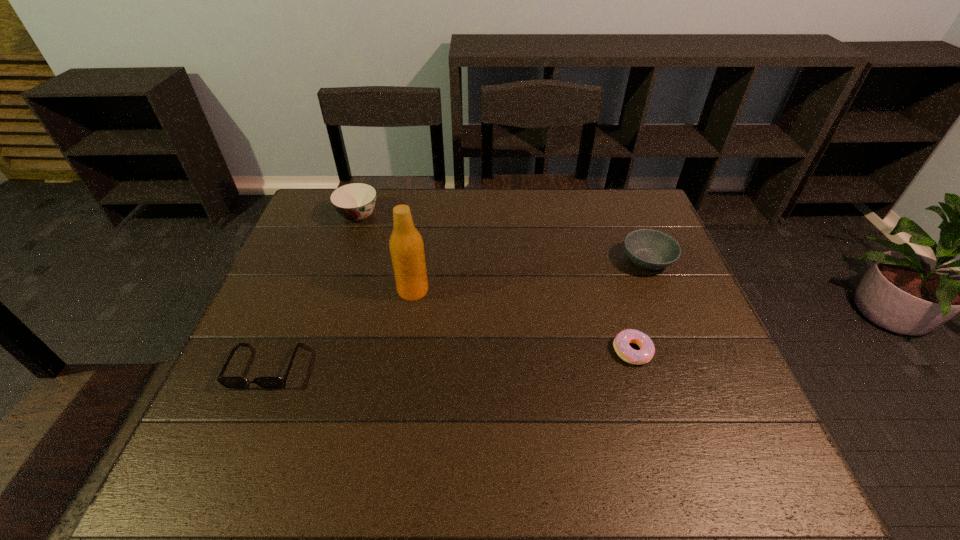
Identify the location of the third object from right to left. Image resolution: width=960 pixels, height=540 pixels. (406, 245).

This screenshot has width=960, height=540. In order to click on beer bottle in this screenshot , I will do `click(406, 245)`.

The width and height of the screenshot is (960, 540). What are the coordinates of `the farthest object` in the screenshot? It's located at (355, 201).

This screenshot has width=960, height=540. What are the coordinates of `the fourth shortest object` in the screenshot? It's located at (355, 201).

Identify the location of the right soup bowl. This screenshot has height=540, width=960. (648, 249).

Where is `the fourth nearest object`? the fourth nearest object is located at coordinates (648, 249).

Locate an element on the screen. the fourth tallest object is located at coordinates (228, 382).

Where is `the shortest object`? The width and height of the screenshot is (960, 540). the shortest object is located at coordinates (621, 345).

Locate an element on the screen. The image size is (960, 540). vacant space located on the back of the third object from left to right is located at coordinates (420, 242).

The height and width of the screenshot is (540, 960). I want to click on vacant space located on the left of the farthest object, so click(308, 216).